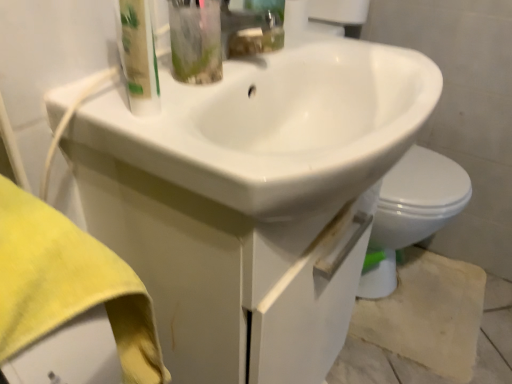
Question: Does beige textured concrete at lower right appear on the left side of translucent plastic bottle at upper left?

Choices:
 (A) no
 (B) yes

Answer: (A)

Question: Would you say translucent plastic bottle at upper left is part of beige textured concrete at lower right's contents?

Choices:
 (A) yes
 (B) no

Answer: (B)

Question: Is beige textured concrete at lower right not within translucent plastic bottle at upper left?

Choices:
 (A) no
 (B) yes

Answer: (B)

Question: Is beige textured concrete at lower right turned away from translucent plastic bottle at upper left?

Choices:
 (A) no
 (B) yes

Answer: (A)

Question: Is beige textured concrete at lower right wider than translucent plastic bottle at upper left?

Choices:
 (A) no
 (B) yes

Answer: (B)

Question: Is the position of beige textured concrete at lower right more distant than that of translucent plastic bottle at upper left?

Choices:
 (A) no
 (B) yes

Answer: (B)

Question: Does white glossy drawer at center have a greater width compared to beige textured concrete at lower right?

Choices:
 (A) yes
 (B) no

Answer: (B)

Question: Is white glossy drawer at center looking in the opposite direction of beige textured concrete at lower right?

Choices:
 (A) yes
 (B) no

Answer: (B)

Question: Is white glossy drawer at center thinner than beige textured concrete at lower right?

Choices:
 (A) yes
 (B) no

Answer: (A)

Question: Does white glossy drawer at center appear on the right side of beige textured concrete at lower right?

Choices:
 (A) yes
 (B) no

Answer: (B)

Question: Would you consider white glossy drawer at center to be distant from beige textured concrete at lower right?

Choices:
 (A) no
 (B) yes

Answer: (A)

Question: Does white glossy drawer at center have a larger size compared to beige textured concrete at lower right?

Choices:
 (A) yes
 (B) no

Answer: (A)

Question: Does white glossy sink at center have a smaller size compared to translucent plastic bottle at upper left?

Choices:
 (A) yes
 (B) no

Answer: (B)